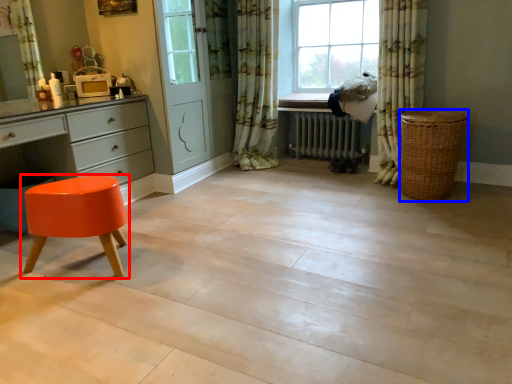
Question: Which object appears closest to the camera in this image, stool (highlighted by a red box) or basket (highlighted by a blue box)?

Choices:
 (A) stool
 (B) basket

Answer: (A)